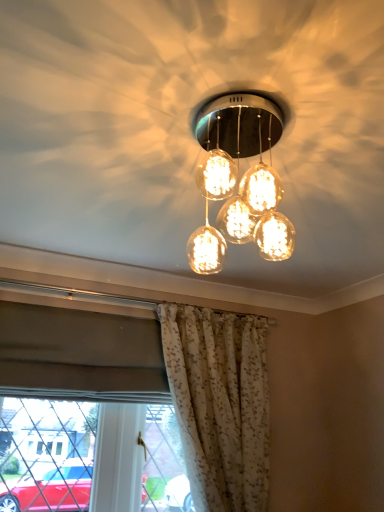
What do you see at coordinates (220, 404) in the screenshot? I see `white floral fabric curtain at lower center` at bounding box center [220, 404].

Find the location of a particular element. This screenshot has width=384, height=512. white floral fabric curtain at lower center is located at coordinates (220, 404).

Find the location of a particular element. Image resolution: width=384 pixels, height=512 pixels. translucent glass globe at center is located at coordinates (241, 179).

Describe the element at coordinates (241, 179) in the screenshot. I see `translucent glass globe at center` at that location.

This screenshot has width=384, height=512. I want to click on white floral fabric curtain at lower center, so click(x=220, y=404).

Based on the photo, between white floral fabric curtain at lower center and translucent glass globe at center, which one appears on the left side from the viewer's perspective?

translucent glass globe at center is more to the left.

Relative to translucent glass globe at center, is white floral fabric curtain at lower center in front or behind?

Clearly, white floral fabric curtain at lower center is behind translucent glass globe at center.

Does point (232, 364) lie behind point (227, 164)?

Yes, point (232, 364) is behind point (227, 164).

From the image's perspective, is white floral fabric curtain at lower center on translucent glass globe at center?

No, from the image's perspective, white floral fabric curtain at lower center is not above translucent glass globe at center.

From a real-world perspective, relative to translucent glass globe at center, is white floral fabric curtain at lower center vertically above or below?

white floral fabric curtain at lower center is situated lower than translucent glass globe at center in the real world.

Considering the relative sizes of white floral fabric curtain at lower center and translucent glass globe at center in the image provided, is white floral fabric curtain at lower center wider than translucent glass globe at center?

No, white floral fabric curtain at lower center is not wider than translucent glass globe at center.

Considering the relative sizes of white floral fabric curtain at lower center and translucent glass globe at center in the image provided, is white floral fabric curtain at lower center taller than translucent glass globe at center?

Indeed, white floral fabric curtain at lower center has a greater height compared to translucent glass globe at center.

Who is smaller, white floral fabric curtain at lower center or translucent glass globe at center?

Smaller between the two is translucent glass globe at center.

Is white floral fabric curtain at lower center surrounding translucent glass globe at center?

No, translucent glass globe at center is not a part of white floral fabric curtain at lower center.

Is white floral fabric curtain at lower center with translucent glass globe at center?

No, white floral fabric curtain at lower center is not with translucent glass globe at center.

Could you tell me if white floral fabric curtain at lower center is turned towards translucent glass globe at center?

Yes, white floral fabric curtain at lower center is oriented towards translucent glass globe at center.

Where is `curtain that is on the right side of translucent glass globe at center`? The image size is (384, 512). curtain that is on the right side of translucent glass globe at center is located at coordinates (220, 404).

Is translucent glass globe at center to the right of white floral fabric curtain at lower center from the viewer's perspective?

Incorrect, translucent glass globe at center is not on the right side of white floral fabric curtain at lower center.

Considering their positions, is translucent glass globe at center located in front of or behind white floral fabric curtain at lower center?

Clearly, translucent glass globe at center is in front of white floral fabric curtain at lower center.

Is point (238, 128) positioned in front of point (255, 456)?

No.

In the scene shown: From the image's perspective, which one is positioned higher, translucent glass globe at center or white floral fabric curtain at lower center?

From the image's view, translucent glass globe at center is above.

From a real-world perspective, is translucent glass globe at center located beneath white floral fabric curtain at lower center?

Incorrect, from a real-world perspective, translucent glass globe at center is higher than white floral fabric curtain at lower center.

Which of these two, translucent glass globe at center or white floral fabric curtain at lower center, is thinner?

Thinner between the two is white floral fabric curtain at lower center.

In terms of height, does translucent glass globe at center look taller or shorter compared to white floral fabric curtain at lower center?

translucent glass globe at center is shorter than white floral fabric curtain at lower center.

Which of these two, translucent glass globe at center or white floral fabric curtain at lower center, is smaller?

translucent glass globe at center is smaller.

Is white floral fabric curtain at lower center surrounded by translucent glass globe at center?

No, white floral fabric curtain at lower center is not surrounded by translucent glass globe at center.

Is translucent glass globe at center far away from white floral fabric curtain at lower center?

translucent glass globe at center is far away from white floral fabric curtain at lower center.

Is translucent glass globe at center aimed at white floral fabric curtain at lower center?

No, translucent glass globe at center is not oriented towards white floral fabric curtain at lower center.

How many degrees apart are the facing directions of translucent glass globe at center and white floral fabric curtain at lower center?

The facing directions of translucent glass globe at center and white floral fabric curtain at lower center are 0.418 degrees apart.

How distant is translucent glass globe at center from white floral fabric curtain at lower center?

translucent glass globe at center is 1.00 meters away from white floral fabric curtain at lower center.

The image size is (384, 512). I want to click on curtain below the translucent glass globe at center (from the image's perspective), so click(220, 404).

Locate an element on the screen. lamp located above the white floral fabric curtain at lower center (from a real-world perspective) is located at coordinates (241, 179).

Image resolution: width=384 pixels, height=512 pixels. In order to click on curtain behind the translucent glass globe at center in this screenshot , I will do pyautogui.click(x=220, y=404).